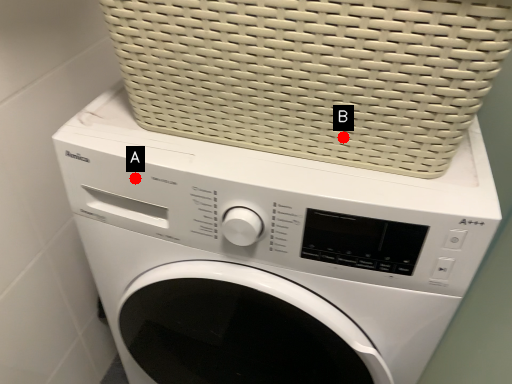
Question: Two points are circled on the image, labeled by A and B beside each circle. Which point is closer to the camera?

Choices:
 (A) A is closer
 (B) B is closer

Answer: (B)